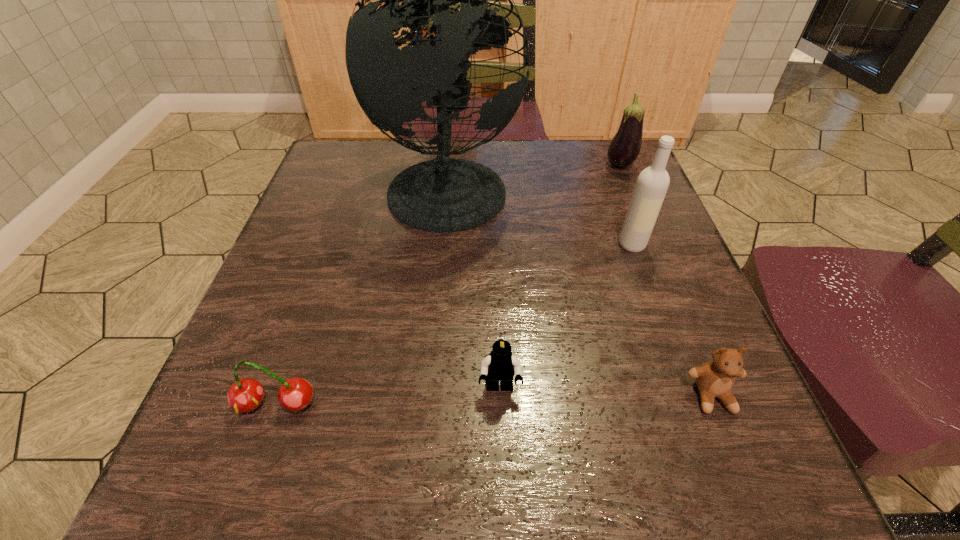
Find the location of `empty space that is in between the Lego and the teddy bear`. empty space that is in between the Lego and the teddy bear is located at coordinates (606, 392).

Identify the location of free area in between the teddy bear and the Lego. The height and width of the screenshot is (540, 960). (606, 392).

Locate an element on the screen. The width and height of the screenshot is (960, 540). empty space between the cherry and the teddy bear is located at coordinates (493, 400).

Where is `vacant area that lies between the teddy bear and the Lego`? Image resolution: width=960 pixels, height=540 pixels. vacant area that lies between the teddy bear and the Lego is located at coordinates (606, 392).

Locate an element on the screen. Image resolution: width=960 pixels, height=540 pixels. free space that is in between the Lego and the eggplant is located at coordinates (560, 277).

At what (x,y) coordinates should I click in order to perform the action: click on object that stands as the fourth closest to the eggplant. Please return your answer as a coordinate pair (x, y). The height and width of the screenshot is (540, 960). Looking at the image, I should click on (500, 365).

Point out which object is positioned as the second nearest to the second tallest object. Please provide its 2D coordinates. Your answer should be formatted as a tuple, i.e. [(x, y)], where the tuple contains the x and y coordinates of a point satisfying the conditions above.

[(625, 146)]

This screenshot has width=960, height=540. Identify the location of vacant space that satisfies the following two spatial constraints: 1. on the front-facing side of the tallest object; 2. with stems pointing upwards on the cherry. (428, 404).